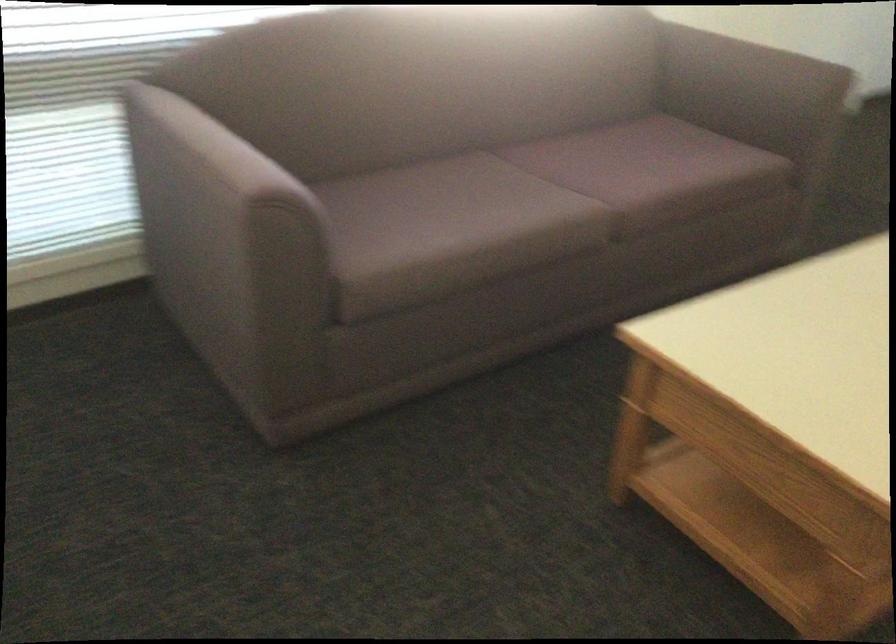
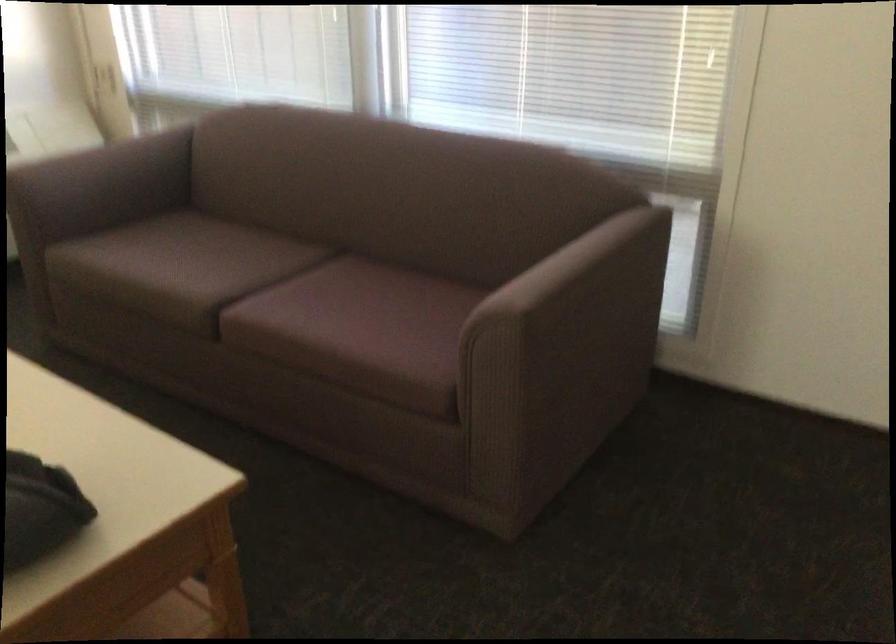
The point at (622, 178) is marked in the first image. Where is the corresponding point in the second image?

(277, 299)